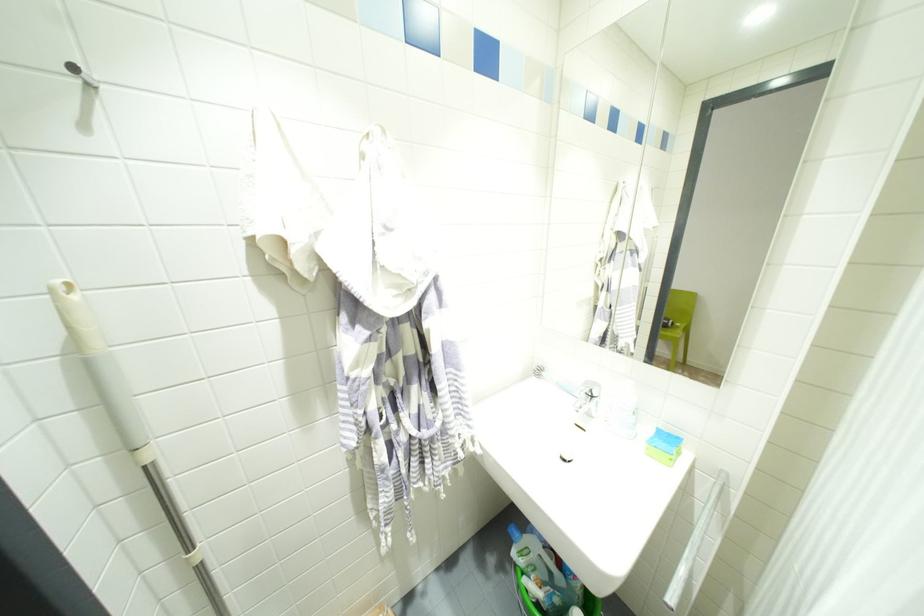
This screenshot has width=924, height=616. Describe the element at coordinates (80, 74) in the screenshot. I see `the metal wall hook` at that location.